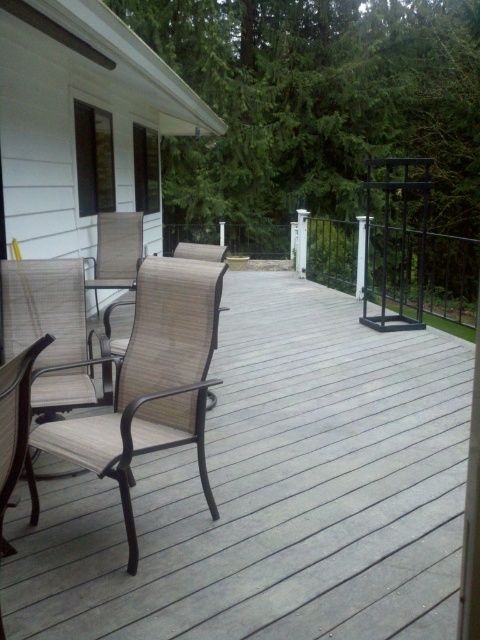
Consider the image. Can you confirm if brown woven chairs at center is taller than sanded wood chair at left?

In fact, brown woven chairs at center may be shorter than sanded wood chair at left.

Is brown woven chairs at center wider than sanded wood chair at left?

Yes.

Describe the element at coordinates (274, 493) in the screenshot. Image resolution: width=480 pixels, height=640 pixels. I see `brown woven chairs at center` at that location.

You are a GUI agent. You are given a task and a screenshot of the screen. Output one action in this format:
    pyautogui.click(x=<x>, y=<y>)
    Task: Click on the brown woven chairs at center
    
    Given the screenshot: What is the action you would take?
    pyautogui.click(x=274, y=493)

Does point (64, 536) lie in front of point (108, 435)?

No, (64, 536) is further to viewer.

Between brown woven chairs at center and beige fabric chair at center, which one is positioned lower?

Positioned lower is brown woven chairs at center.

Is point (236, 426) closer to viewer compared to point (154, 371)?

That is False.

Image resolution: width=480 pixels, height=640 pixels. What are the coordinates of `brown woven chairs at center` in the screenshot? It's located at (274, 493).

Does point (12, 484) come behind point (132, 243)?

No.

Between sanded wood chair at left and sandy beige woven chair at center, which one is positioned lower?

sanded wood chair at left

Between point (12, 424) and point (107, 253), which one is positioned behind?

The point (107, 253) is more distant.

You are a GUI agent. You are given a task and a screenshot of the screen. Output one action in this format:
    pyautogui.click(x=<x>, y=<y>)
    Task: Click on the sanded wood chair at left
    This screenshot has width=480, height=640.
    Given the screenshot: What is the action you would take?
    pyautogui.click(x=14, y=419)